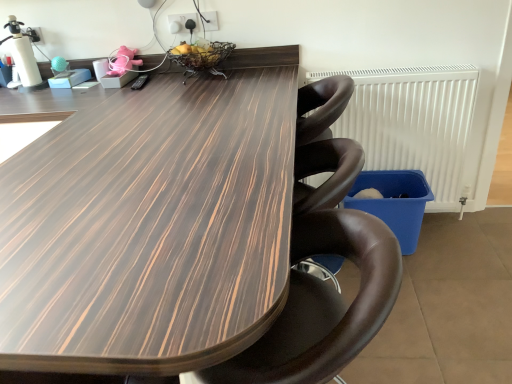
Question: Considering the relative positions of brown leather chair at center and white plastic radiator at right in the image provided, is brown leather chair at center to the left of white plastic radiator at right from the viewer's perspective?

Choices:
 (A) yes
 (B) no

Answer: (A)

Question: From the image's perspective, is brown leather chair at center on top of white plastic radiator at right?

Choices:
 (A) yes
 (B) no

Answer: (B)

Question: Does brown leather chair at center have a lesser width compared to white plastic radiator at right?

Choices:
 (A) no
 (B) yes

Answer: (A)

Question: Is white plastic radiator at right at the back of brown leather chair at center?

Choices:
 (A) no
 (B) yes

Answer: (A)

Question: Considering the relative positions of brown leather chair at center and white plastic radiator at right in the image provided, is brown leather chair at center to the right of white plastic radiator at right from the viewer's perspective?

Choices:
 (A) yes
 (B) no

Answer: (B)

Question: Is white plastic radiator at right spatially inside brown leather chair at center, or outside of it?

Choices:
 (A) outside
 (B) inside

Answer: (A)

Question: From a real-world perspective, is white plastic radiator at right physically located above or below brown leather chair at center?

Choices:
 (A) below
 (B) above

Answer: (B)

Question: Considering their positions, is white plastic radiator at right located in front of or behind brown leather chair at center?

Choices:
 (A) behind
 (B) front

Answer: (A)

Question: Considering the positions of white plastic radiator at right and brown leather chair at center in the image, is white plastic radiator at right bigger or smaller than brown leather chair at center?

Choices:
 (A) big
 (B) small

Answer: (B)

Question: Is brown leather chair at center situated inside white plastic radiator at right or outside?

Choices:
 (A) outside
 (B) inside

Answer: (A)

Question: From a real-world perspective, is brown leather chair at center above or below white plastic radiator at right?

Choices:
 (A) below
 (B) above

Answer: (A)

Question: Is brown leather chair at center bigger or smaller than white plastic radiator at right?

Choices:
 (A) big
 (B) small

Answer: (A)

Question: In the image, is brown leather chair at center positioned in front of or behind white plastic radiator at right?

Choices:
 (A) behind
 (B) front

Answer: (B)

Question: From the image's perspective, is wooden table at center positioned above or below white plastic radiator at right?

Choices:
 (A) above
 (B) below

Answer: (B)

Question: From a real-world perspective, relative to white plastic radiator at right, is wooden table at center vertically above or below?

Choices:
 (A) below
 (B) above

Answer: (A)